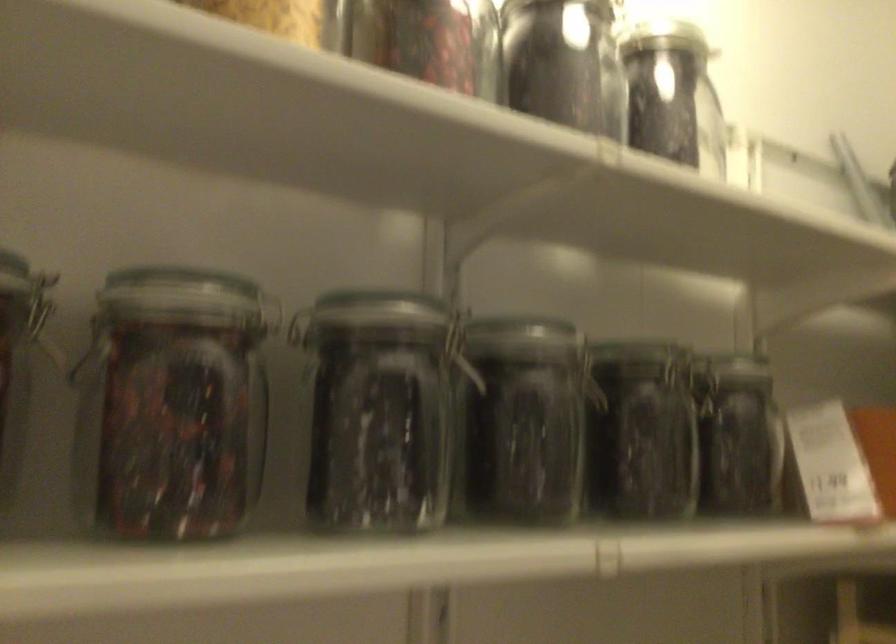
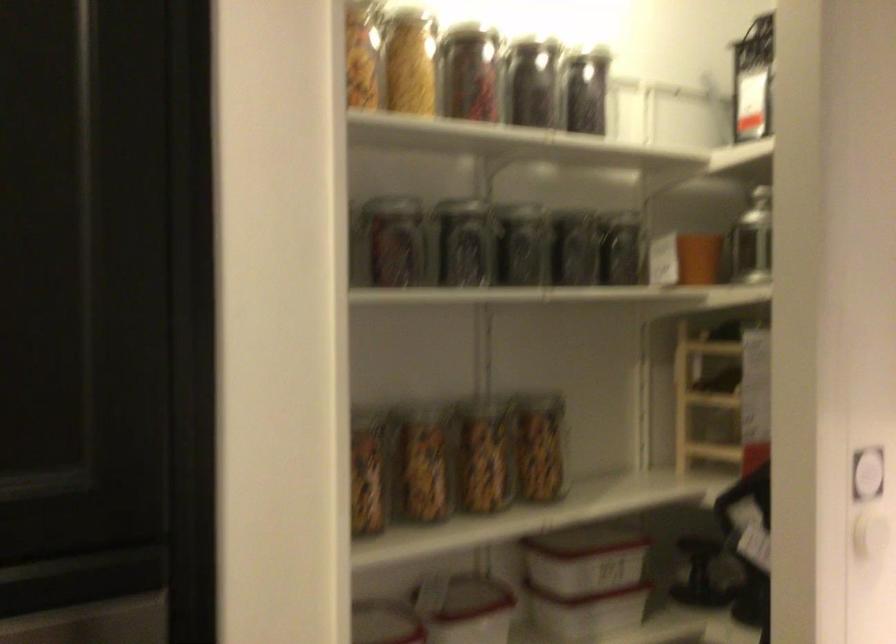
The point at [639,428] is marked in the first image. Where is the corresponding point in the second image?

(574, 249)